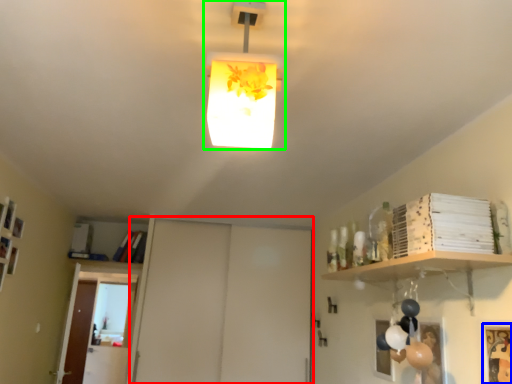
Question: Which object is positioned farthest from door (highlighted by a red box)? Select from picture frame (highlighted by a blue box) and lamp (highlighted by a green box).

Choices:
 (A) picture frame
 (B) lamp

Answer: (B)